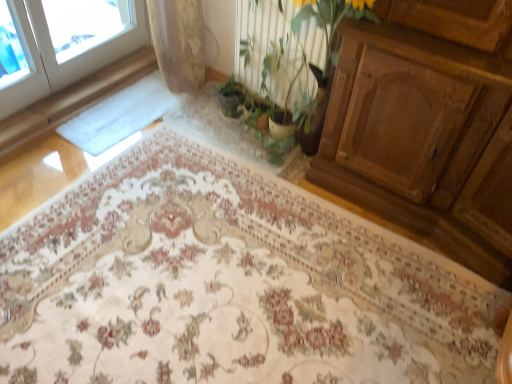
What do you see at coordinates (232, 97) in the screenshot? I see `green matte plant at center` at bounding box center [232, 97].

Measure the distance between floral carpet at center and camera.

A distance of 1.35 meters exists between floral carpet at center and camera.

Find the location of a particular element. green matte plant at center is located at coordinates (232, 97).

Looking at this image, would you consider green leafy plant at center to be distant from green matte plant at center?

That's not correct — green leafy plant at center is a little close to green matte plant at center.

Considering the sizes of objects green leafy plant at center and green matte plant at center in the image provided, who is wider, green leafy plant at center or green matte plant at center?

With larger width is green leafy plant at center.

From the image's perspective, is green leafy plant at center above or below green matte plant at center?

Based on their image positions, green leafy plant at center is located above green matte plant at center.

The image size is (512, 384). Find the location of `floral arrangement above the green matte plant at center (from the image's perspective)`. floral arrangement above the green matte plant at center (from the image's perspective) is located at coordinates tap(292, 50).

Looking at their sizes, would you say green leafy plant at center is wider or thinner than floral carpet at center?

Considering their sizes, green leafy plant at center looks slimmer than floral carpet at center.

Looking at this image, which of these two, green leafy plant at center or floral carpet at center, is smaller?

green leafy plant at center is smaller.

Is green leafy plant at center not near floral carpet at center?

No, green leafy plant at center is not far away from floral carpet at center.

Does green leafy plant at center have a greater height compared to floral carpet at center?

Indeed, green leafy plant at center has a greater height compared to floral carpet at center.

Which is correct: green matte plant at center is inside floral carpet at center, or outside of it?

green matte plant at center is spatially situated outside floral carpet at center.

Could you tell me if green matte plant at center is facing floral carpet at center?

No, green matte plant at center is not facing towards floral carpet at center.

How many degrees apart are the facing directions of green matte plant at center and floral carpet at center?

0.669 degrees separate the facing orientations of green matte plant at center and floral carpet at center.

Considering the relative sizes of floral carpet at center and green leafy plant at center in the image provided, is floral carpet at center wider than green leafy plant at center?

Yes.

Does floral carpet at center appear on the right side of green leafy plant at center?

In fact, floral carpet at center is to the left of green leafy plant at center.

Can you confirm if floral carpet at center is smaller than green leafy plant at center?

Incorrect, floral carpet at center is not smaller in size than green leafy plant at center.

Looking at this image, in the image, is floral carpet at center positioned in front of or behind green leafy plant at center?

In the image, floral carpet at center appears in front of green leafy plant at center.

Does green matte plant at center contain green leafy plant at center?

Definitely not — green leafy plant at center is not inside green matte plant at center.

Between green matte plant at center and green leafy plant at center, which one has more height?

green leafy plant at center.

Is green matte plant at center in front of green leafy plant at center?

No.

From the image's perspective, is green matte plant at center located beneath green leafy plant at center?

Indeed, from the image's perspective, green matte plant at center is shown beneath green leafy plant at center.

This screenshot has width=512, height=384. In order to click on houseplant located above the floral carpet at center (from a real-world perspective) in this screenshot , I will do `click(232, 97)`.

Is floral carpet at center facing towards green matte plant at center?

No, floral carpet at center is not oriented towards green matte plant at center.

Which object is closer to the camera, floral carpet at center or green matte plant at center?

floral carpet at center is more forward.

Can you confirm if floral carpet at center is positioned to the left of green matte plant at center?

Yes.

Where is `houseplant below the green leafy plant at center (from a real-world perspective)`? The width and height of the screenshot is (512, 384). houseplant below the green leafy plant at center (from a real-world perspective) is located at coordinates (232, 97).

Locate an element on the screen. This screenshot has height=384, width=512. mat that appears below the green leafy plant at center (from the image's perspective) is located at coordinates (229, 284).

When comparing their distances from green leafy plant at center, does floral carpet at center or green matte plant at center seem further?

Based on the image, floral carpet at center appears to be further to green leafy plant at center.

Estimate the real-world distances between objects in this image. Which object is further from floral carpet at center, green leafy plant at center or green matte plant at center?

green matte plant at center.

Which object lies nearer to the anchor point green leafy plant at center, green matte plant at center or floral carpet at center?

green matte plant at center lies closer to green leafy plant at center than the other object.

From the image, which object appears to be nearer to green matte plant at center, floral carpet at center or green leafy plant at center?

green leafy plant at center is positioned closer to the anchor green matte plant at center.

Looking at the image, which one is located further to floral carpet at center, green matte plant at center or green leafy plant at center?

green matte plant at center is further to floral carpet at center.

From the picture: Estimate the real-world distances between objects in this image. Which object is further from green matte plant at center, green leafy plant at center or floral carpet at center?

floral carpet at center is further to green matte plant at center.

Find the location of `floral arrangement located between floral carpet at center and green matte plant at center in the depth direction`. floral arrangement located between floral carpet at center and green matte plant at center in the depth direction is located at coordinates (292, 50).